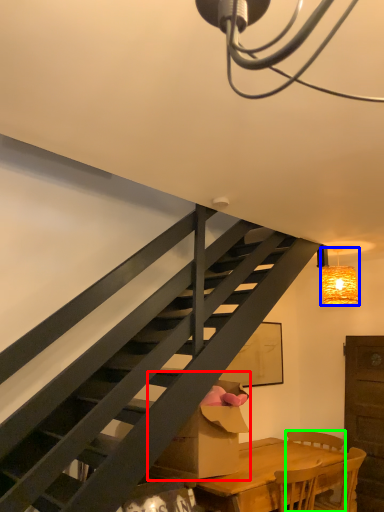
Question: Based on their relative distances, which object is nearer to cardboard box (highlighted by a red box)? Choose from lamp (highlighted by a blue box) and chair (highlighted by a green box).

Choices:
 (A) lamp
 (B) chair

Answer: (B)